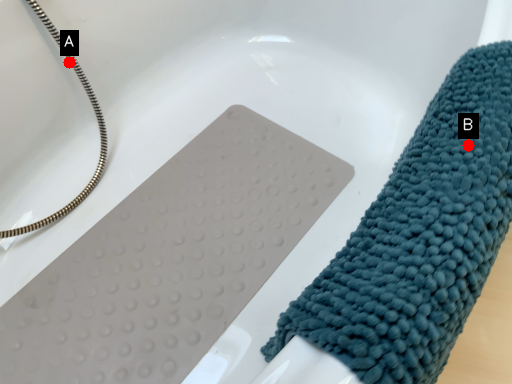
Question: Two points are circled on the image, labeled by A and B beside each circle. Which point is closer to the camera?

Choices:
 (A) A is closer
 (B) B is closer

Answer: (B)